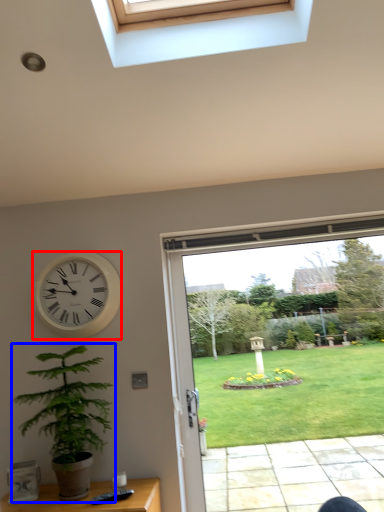
Question: Which object is closer to the camera taking this photo, wall clock (highlighted by a red box) or houseplant (highlighted by a blue box)?

Choices:
 (A) wall clock
 (B) houseplant

Answer: (B)